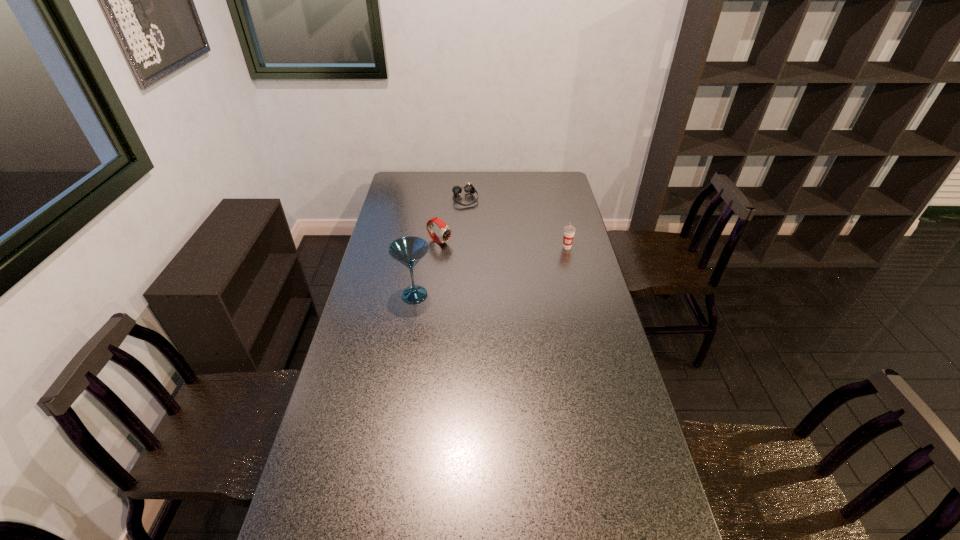
Find the location of `vacant region located through the lenses of the shortest object`. vacant region located through the lenses of the shortest object is located at coordinates (481, 232).

This screenshot has width=960, height=540. Identify the location of free space located through the lenses of the shortest object. (475, 220).

Locate an element on the screen. The image size is (960, 540). vacant area situated on the face of the watch is located at coordinates (502, 276).

Find the location of `vacant space located 0.120m on the face of the watch`. vacant space located 0.120m on the face of the watch is located at coordinates (469, 258).

Locate an element on the screen. blank space located 0.050m on the face of the watch is located at coordinates (457, 251).

Locate an element on the screen. This screenshot has height=540, width=960. object that is at the far edge is located at coordinates (468, 188).

This screenshot has height=540, width=960. I want to click on object that is at the left edge, so click(x=408, y=251).

Find the location of a particular element. Image resolution: width=960 pixels, height=540 pixels. object positioned at the right edge is located at coordinates click(x=569, y=231).

I want to click on blank space at the far edge of the desktop, so click(469, 175).

At what (x,y) coordinates should I click in order to perform the action: click on vacant point at the left edge. Please return your answer as a coordinate pair (x, y). Image resolution: width=960 pixels, height=540 pixels. Looking at the image, I should click on (389, 253).